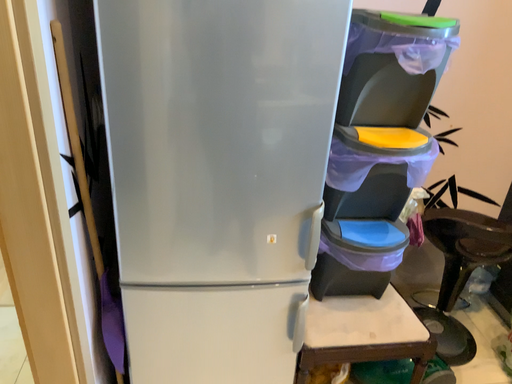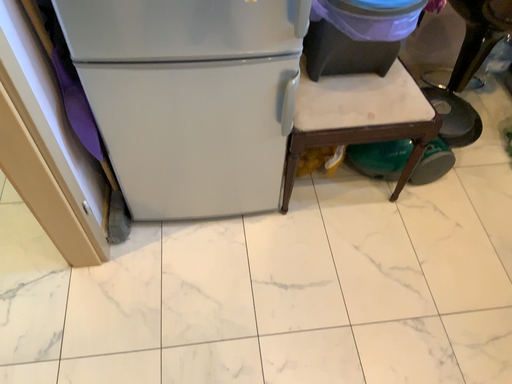
Question: Which way did the camera rotate in the video?

Choices:
 (A) rotated upward
 (B) rotated downward

Answer: (B)